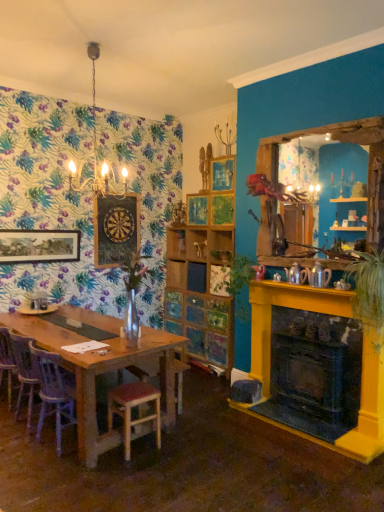
At what (x,y) coordinates should I click in order to perform the action: click on vacant area on top of wooden mirror at right (from a real-world perspective). Please return your answer as a coordinate pair (x, y). Looking at the image, I should click on (309, 129).